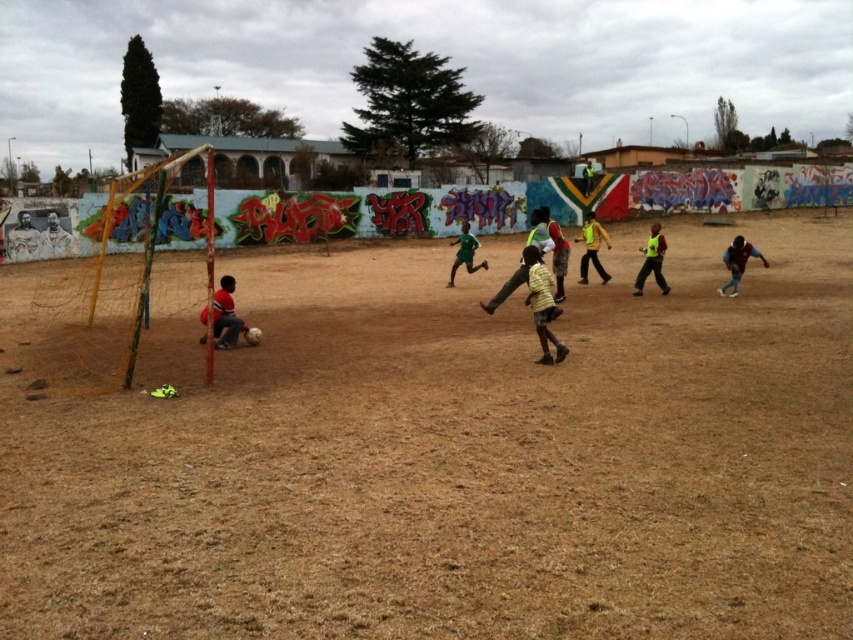
Which of these two, yellow matte vest at center or yellow reflective vest at center, stands taller?

yellow matte vest at center

Does point (607, 248) lie in front of point (654, 221)?

Yes, it is.

Which is behind, point (589, 220) or point (648, 266)?

The point (589, 220) is behind.

Find the location of `yellow matte vest at center`. yellow matte vest at center is located at coordinates (592, 248).

Which is above, yellow matte shirt at center or yellow matte vest at center?

Positioned higher is yellow matte vest at center.

The width and height of the screenshot is (853, 640). What do you see at coordinates (543, 305) in the screenshot? I see `yellow matte shirt at center` at bounding box center [543, 305].

The image size is (853, 640). I want to click on yellow matte shirt at center, so click(543, 305).

Who is lower down, brown dry grass at center or yellow matte vest at center?

Positioned lower is brown dry grass at center.

Is brown dry grass at center to the left of yellow matte vest at center from the viewer's perspective?

Yes, brown dry grass at center is to the left of yellow matte vest at center.

Who is more distant from viewer, (289, 344) or (585, 253)?

Point (585, 253)

You are a GUI agent. You are given a task and a screenshot of the screen. Output one action in this format:
    pyautogui.click(x=<x>, y=<y>)
    Task: Click on the brown dry grass at center
    This screenshot has width=853, height=640.
    Given the screenshot: What is the action you would take?
    pyautogui.click(x=451, y=456)